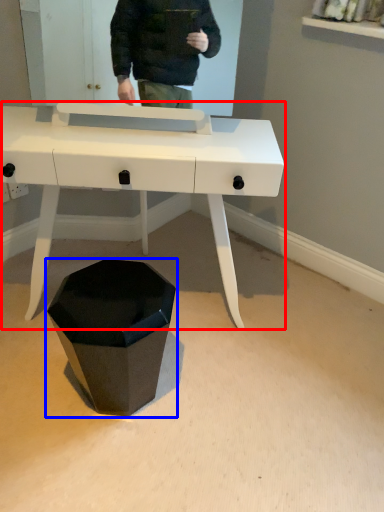
Question: Which object is further to the camera taking this photo, desk (highlighted by a red box) or waste container (highlighted by a blue box)?

Choices:
 (A) desk
 (B) waste container

Answer: (B)